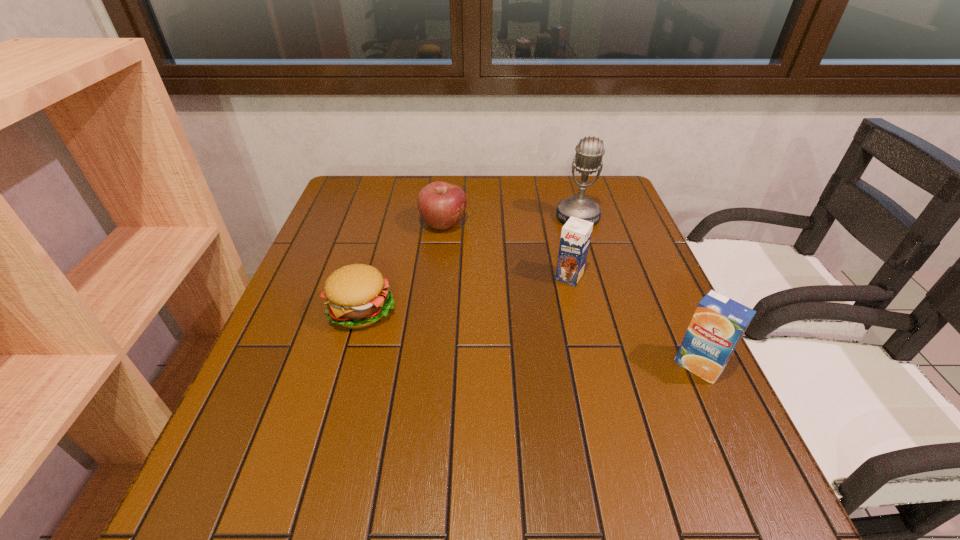
At what (x,y) coordinates should I click in order to perform the action: click on vacant point located between the orange_juice and the chocolate milk. Please return your answer as a coordinate pair (x, y). Looking at the image, I should click on (634, 321).

At what (x,y) coordinates should I click in order to perform the action: click on empty space that is in between the microphone and the nearest object. Please return your answer as a coordinate pair (x, y). This screenshot has width=960, height=540. Looking at the image, I should click on (638, 291).

Where is `empty location between the microphone and the rightmost object`? empty location between the microphone and the rightmost object is located at coordinates (638, 291).

Where is `vacant space in between the tallest object and the nearest object`? This screenshot has width=960, height=540. vacant space in between the tallest object and the nearest object is located at coordinates (638, 291).

You are a GUI agent. You are given a task and a screenshot of the screen. Output one action in this format:
    pyautogui.click(x=<x>, y=<y>)
    Task: Click on the unoccupied area between the chocolate milk and the leftmost object
    This screenshot has height=540, width=960.
    Given the screenshot: What is the action you would take?
    pyautogui.click(x=466, y=293)

The height and width of the screenshot is (540, 960). Identify the location of vacant point located between the tallest object and the hamburger. [470, 263].

Identify the location of free space between the leftmost object and the second object from left to right. The width and height of the screenshot is (960, 540). (402, 267).

Locate an element on the screen. The image size is (960, 540). the closest object to the fourth object from right to left is located at coordinates (357, 296).

The image size is (960, 540). In order to click on object that is the closest to the apple in this screenshot , I will do `click(357, 296)`.

I want to click on vacant area in the image that satisfies the following two spatial constraints: 1. on the front side of the apple; 2. on the right side of the chocolate milk, so click(x=438, y=277).